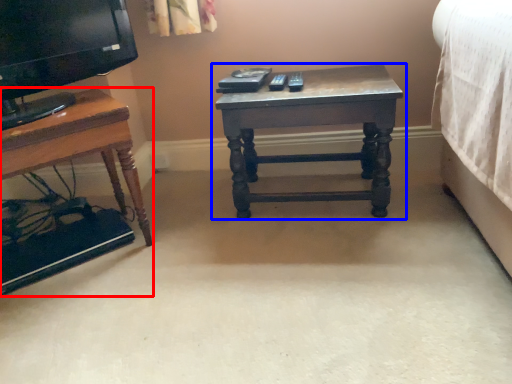
Question: Which of the following is the closest to the observer, table (highlighted by a red box) or table (highlighted by a blue box)?

Choices:
 (A) table
 (B) table

Answer: (A)